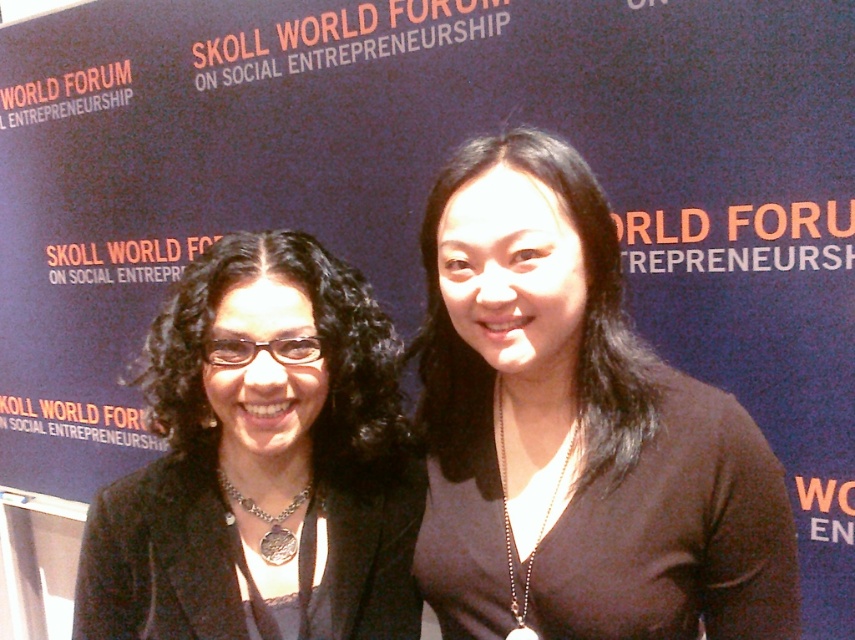
Question: From the image, what is the correct spatial relationship of black matte shirt at center in relation to matte black jacket at left?

Choices:
 (A) below
 (B) above

Answer: (B)

Question: Which of the following is the closest to the observer?

Choices:
 (A) black matte shirt at center
 (B) matte black jacket at left

Answer: (A)

Question: Can you confirm if black matte shirt at center is positioned below matte black jacket at left?

Choices:
 (A) no
 (B) yes

Answer: (A)

Question: Which object is farther from the camera taking this photo?

Choices:
 (A) black matte shirt at center
 (B) matte black jacket at left

Answer: (B)

Question: Can you confirm if black matte shirt at center is positioned to the right of matte black jacket at left?

Choices:
 (A) yes
 (B) no

Answer: (A)